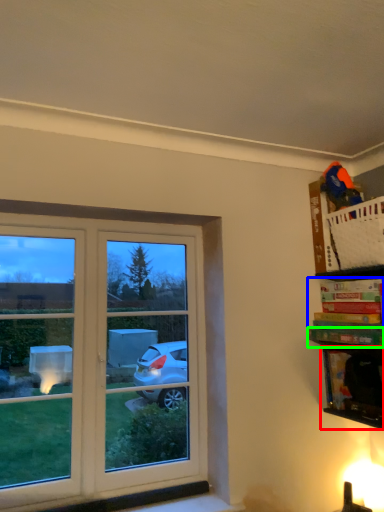
Question: Which object is the closest to the cabinet (highlighted by a red box)? Choose among these: book (highlighted by a blue box) or book (highlighted by a green box).

Choices:
 (A) book
 (B) book

Answer: (B)